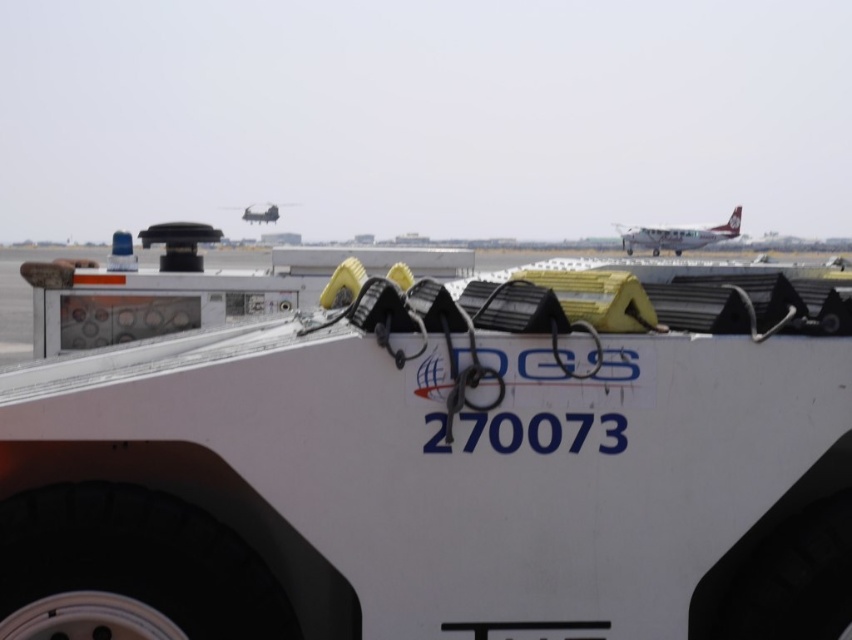
Question: Which of the following is the farthest from the observer?

Choices:
 (A) metallic silver airplane at upper center
 (B) white matte trailer truck at center

Answer: (A)

Question: Which of the following is the closest to the observer?

Choices:
 (A) (231, 208)
 (B) (262, 592)

Answer: (B)

Question: Observing the image, what is the correct spatial positioning of white matte trailer truck at center in reference to white matte airplane at upper right?

Choices:
 (A) left
 (B) right

Answer: (A)

Question: Can you confirm if white matte airplane at upper right is wider than metallic silver airplane at upper center?

Choices:
 (A) no
 (B) yes

Answer: (B)

Question: Which point is farther to the camera?

Choices:
 (A) metallic silver airplane at upper center
 (B) white matte trailer truck at center

Answer: (A)

Question: Does white matte trailer truck at center have a lesser width compared to metallic silver airplane at upper center?

Choices:
 (A) yes
 (B) no

Answer: (A)